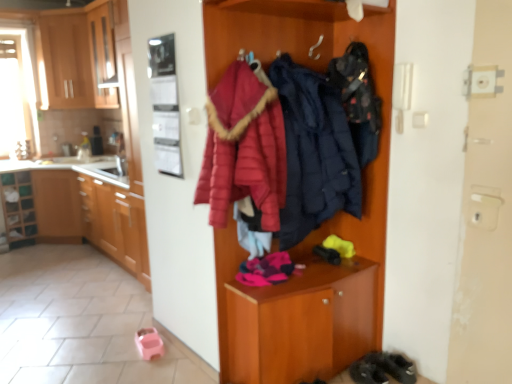
Question: From a real-world perspective, relative to metallic refrigerator at upper left, is dark gray suede shoes at lower right vertically above or below?

Choices:
 (A) above
 (B) below

Answer: (B)

Question: Which is correct: dark gray suede shoes at lower right is inside metallic refrigerator at upper left, or outside of it?

Choices:
 (A) outside
 (B) inside

Answer: (A)

Question: Which is nearer to the metallic refrigerator at upper left?

Choices:
 (A) white glossy countertop at left
 (B) wooden cabinet at center
 (C) matte red bathrobe at center
 (D) dark gray suede shoes at lower right
 (E) wooden cabinet at upper left, the third cabinetry from the bottom

Answer: (C)

Question: Estimate the real-world distances between objects in this image. Which object is farther from the dark gray suede shoes at lower right?

Choices:
 (A) wooden shelf at left
 (B) metallic refrigerator at upper left
 (C) wooden cabinet at upper left, acting as the 1th cabinetry starting from the top
 (D) matte red bathrobe at center
 (E) matte blue puffer jacket at center, marked as the 2th clothing in a right-to-left arrangement

Answer: (C)